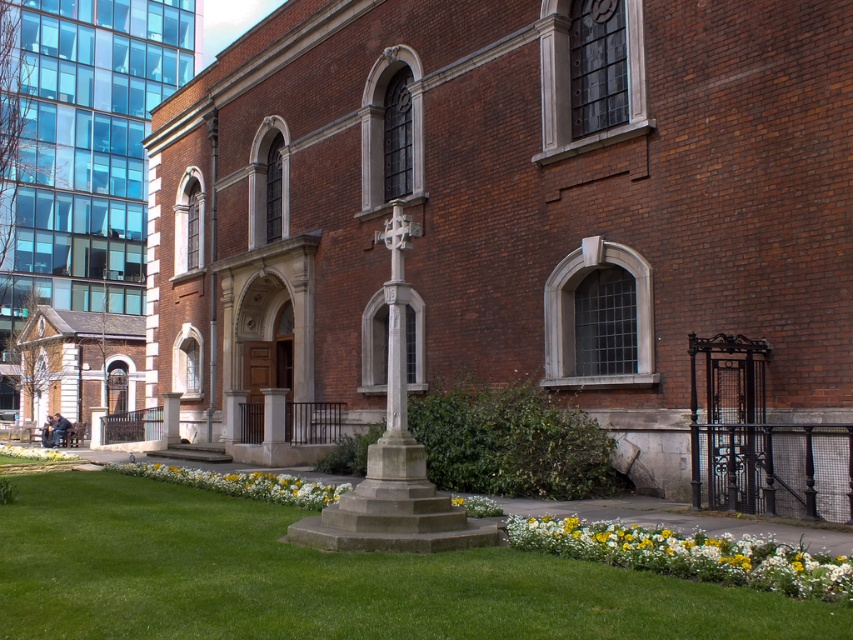
You are standing at the entrance of the traditional brick church and want to place a new decorative item exactly at the location of the yellow matte flowers at lower center. What are the coordinates of that location?

The coordinates of the yellow matte flowers at lower center are at point [689,556].